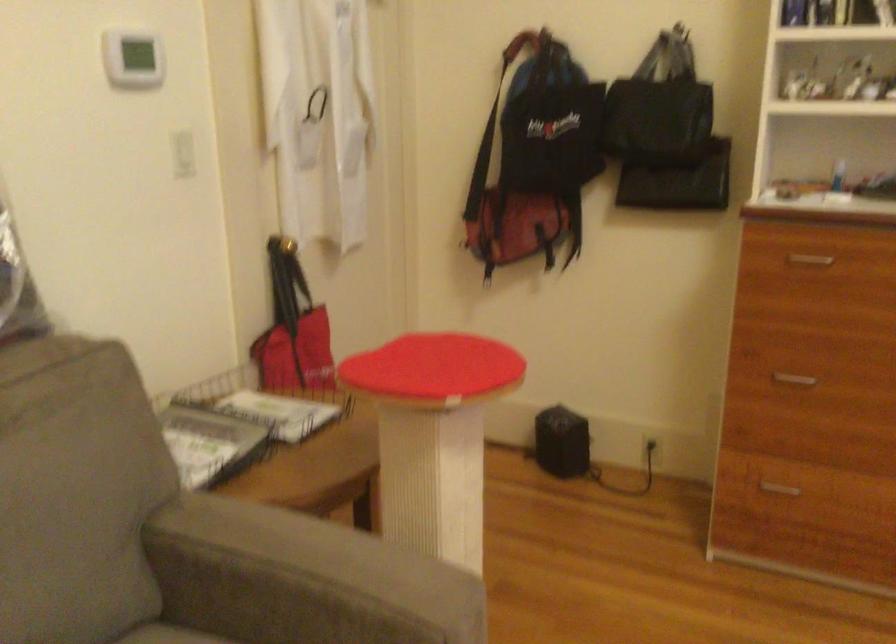
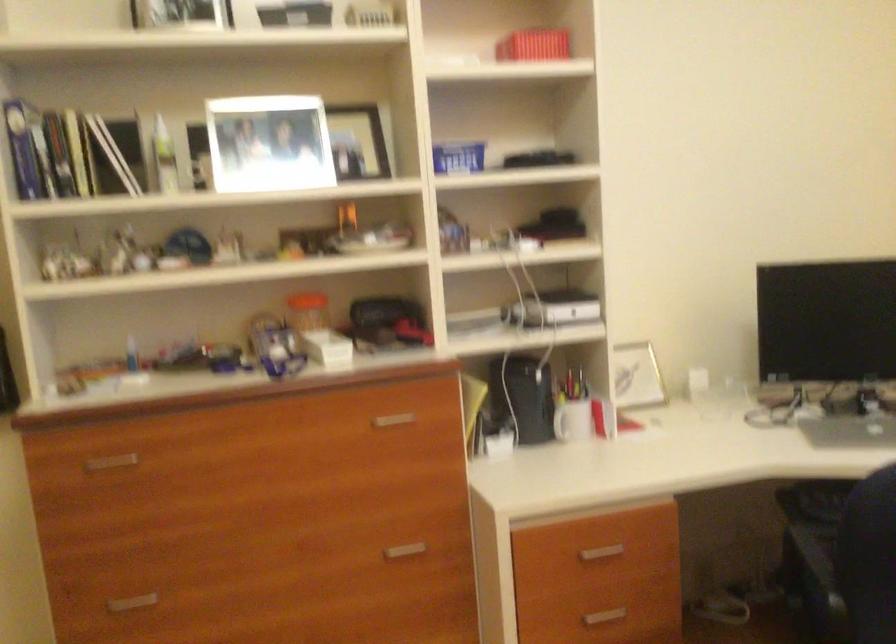
Question: Based on the continuous images, in which direction is the camera rotating? Reply with the corresponding letter.

Choices:
 (A) Left
 (B) Right
 (C) Up
 (D) Down

Answer: (B)